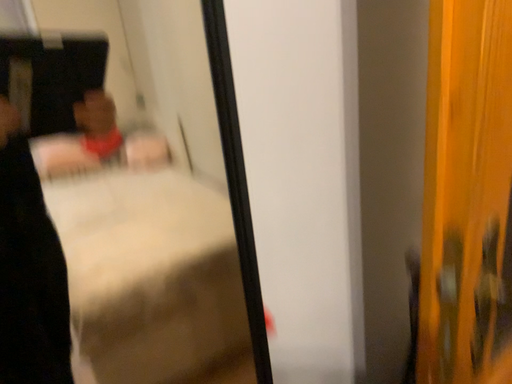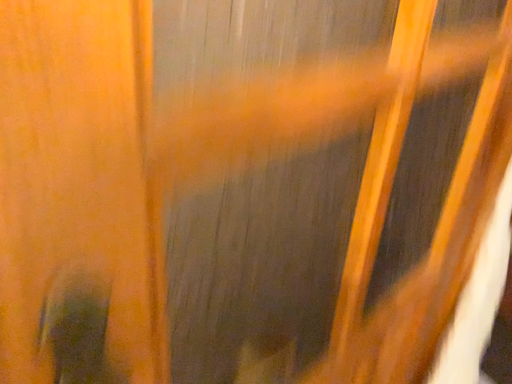
Question: Which way did the camera rotate in the video?

Choices:
 (A) rotated left
 (B) rotated right

Answer: (B)